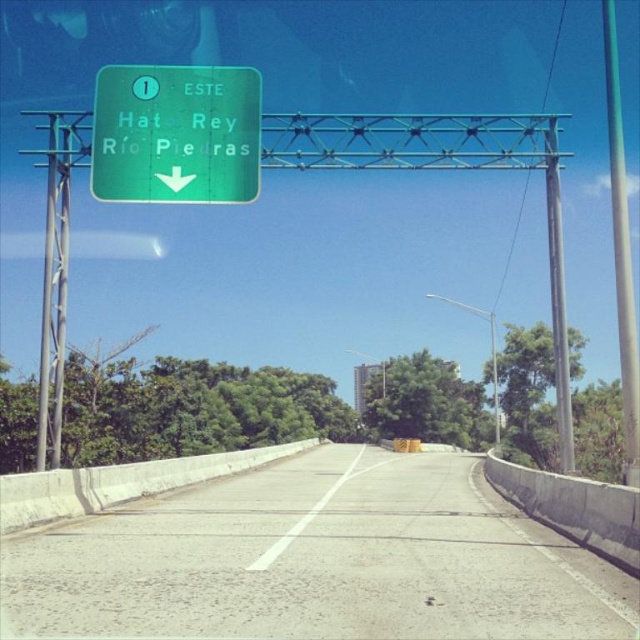
You are sitting in the driver seat of the vehicle and see two points marked on the road ahead. The first point is at coordinates point (314,589) and the second point is at point (557,419). Which point is closer to your current position?

The point at (314,589) is closer to your current position because it is closer to the camera than the point at (557,419).

You are a driver who needs to read the directions on the green glossy sign at upper center while passing by the metallic gray pole at right. Considering their sizes, which object would be harder to see from a distance?

The green glossy sign at upper center has a smaller size compared to the metallic gray pole at right, so it would be harder to see from a distance.

You are a GPS system trying to determine the current location of the vehicle. The vehicle is on a highway under a bright blue sky with concrete barriers. There is a green overhead sign indicating directions for Hato Rey and Rio Piedras. Where is the gray concrete highway at center located in terms of coordinates?

The gray concrete highway at center is located at coordinates point (316, 560).